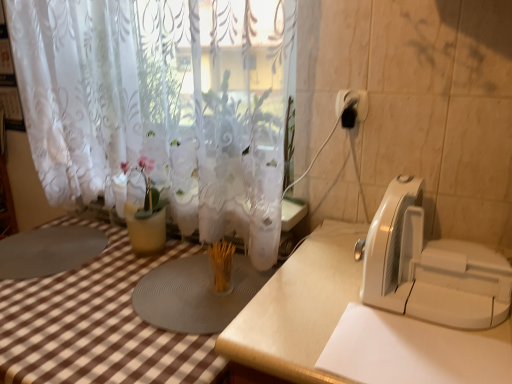
Question: Does white lace curtain at upper center turn towards white plastic appliance at right?

Choices:
 (A) yes
 (B) no

Answer: (B)

Question: From the image's perspective, is white lace curtain at upper center located above white plastic appliance at right?

Choices:
 (A) no
 (B) yes

Answer: (B)

Question: Does white lace curtain at upper center have a greater width compared to white plastic appliance at right?

Choices:
 (A) yes
 (B) no

Answer: (B)

Question: Can you confirm if white lace curtain at upper center is positioned to the left of white plastic appliance at right?

Choices:
 (A) no
 (B) yes

Answer: (B)

Question: Is white lace curtain at upper center smaller than white plastic appliance at right?

Choices:
 (A) yes
 (B) no

Answer: (B)

Question: Is the depth of white lace curtain at upper center greater than that of white plastic appliance at right?

Choices:
 (A) yes
 (B) no

Answer: (A)

Question: From a real-world perspective, is white matte table at center located beneath white lace curtain at upper center?

Choices:
 (A) no
 (B) yes

Answer: (B)

Question: Is white matte table at center closer to camera compared to white lace curtain at upper center?

Choices:
 (A) yes
 (B) no

Answer: (A)

Question: Can you confirm if white matte table at center is positioned to the left of white lace curtain at upper center?

Choices:
 (A) no
 (B) yes

Answer: (A)

Question: From the image's perspective, does white matte table at center appear lower than white lace curtain at upper center?

Choices:
 (A) no
 (B) yes

Answer: (B)

Question: Is white matte table at center thinner than white lace curtain at upper center?

Choices:
 (A) no
 (B) yes

Answer: (A)

Question: Can you confirm if white matte table at center is wider than white lace curtain at upper center?

Choices:
 (A) yes
 (B) no

Answer: (A)

Question: Does white lace curtain at upper center appear on the right side of black plastic electric outlet at upper right?

Choices:
 (A) yes
 (B) no

Answer: (B)